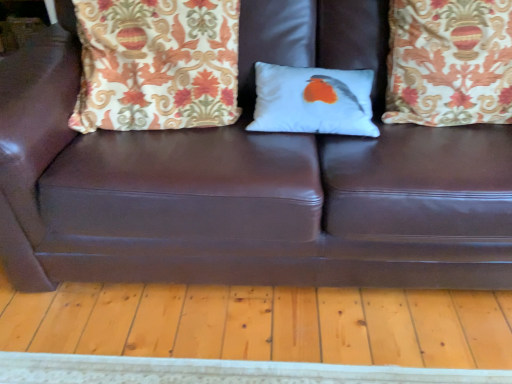
Question: From the image's perspective, is patterned fabric pillow at upper right, the first pillow when ordered from right to left, over patterned fabric pillow at upper left, the third pillow positioned from the right?

Choices:
 (A) yes
 (B) no

Answer: (B)

Question: Is patterned fabric pillow at upper right, which appears as the third pillow when viewed from the left, thinner than patterned fabric pillow at upper left, the third pillow positioned from the right?

Choices:
 (A) no
 (B) yes

Answer: (B)

Question: From a real-world perspective, does patterned fabric pillow at upper right, the first pillow when ordered from right to left, sit lower than patterned fabric pillow at upper left, placed as the 1th pillow when sorted from left to right?

Choices:
 (A) no
 (B) yes

Answer: (B)

Question: Is patterned fabric pillow at upper right, the first pillow when ordered from right to left, turned away from patterned fabric pillow at upper left, the third pillow positioned from the right?

Choices:
 (A) yes
 (B) no

Answer: (B)

Question: Considering the relative sizes of patterned fabric pillow at upper right, which appears as the third pillow when viewed from the left, and patterned fabric pillow at upper left, the third pillow positioned from the right, in the image provided, is patterned fabric pillow at upper right, which appears as the third pillow when viewed from the left, smaller than patterned fabric pillow at upper left, the third pillow positioned from the right,?

Choices:
 (A) yes
 (B) no

Answer: (A)

Question: Is patterned fabric pillow at upper left, the third pillow positioned from the right, surrounded by patterned fabric pillow at upper right, which appears as the third pillow when viewed from the left?

Choices:
 (A) no
 (B) yes

Answer: (A)

Question: Is patterned fabric pillow at upper left, the third pillow positioned from the right, surrounded by white matte pillow with bird design at center, the 2th pillow positioned from the left?

Choices:
 (A) yes
 (B) no

Answer: (B)

Question: Can you confirm if white matte pillow with bird design at center, the 2th pillow positioned from the left, is smaller than patterned fabric pillow at upper left, the third pillow positioned from the right?

Choices:
 (A) no
 (B) yes

Answer: (B)

Question: Is white matte pillow with bird design at center, which is the second pillow from right to left, facing towards patterned fabric pillow at upper left, the third pillow positioned from the right?

Choices:
 (A) yes
 (B) no

Answer: (B)

Question: Is the position of white matte pillow with bird design at center, the 2th pillow positioned from the left, more distant than that of patterned fabric pillow at upper left, placed as the 1th pillow when sorted from left to right?

Choices:
 (A) no
 (B) yes

Answer: (B)

Question: From the image's perspective, is white matte pillow with bird design at center, which is the second pillow from right to left, on top of patterned fabric pillow at upper left, the third pillow positioned from the right?

Choices:
 (A) yes
 (B) no

Answer: (B)

Question: Is the position of white matte pillow with bird design at center, which is the second pillow from right to left, less distant than that of patterned fabric pillow at upper left, placed as the 1th pillow when sorted from left to right?

Choices:
 (A) yes
 (B) no

Answer: (B)

Question: Is patterned fabric pillow at upper left, the third pillow positioned from the right, oriented towards patterned fabric pillow at upper right, which appears as the third pillow when viewed from the left?

Choices:
 (A) no
 (B) yes

Answer: (A)